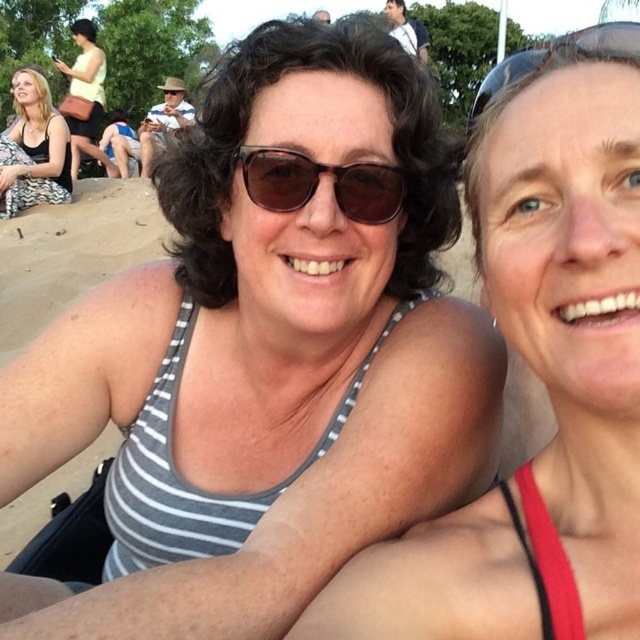
Question: Is gray striped tank top at center above transparent plastic goggles at upper right?

Choices:
 (A) yes
 (B) no

Answer: (B)

Question: Which of the following is the farthest from the observer?

Choices:
 (A) beige sand at lower left
 (B) gray striped tank top at center
 (C) matte black tank top at lower left

Answer: (C)

Question: In this image, where is brown matte sunglasses at center located relative to transparent plastic goggles at upper right?

Choices:
 (A) above
 (B) below

Answer: (B)

Question: Which of the following is the farthest from the observer?

Choices:
 (A) gray striped tank top at center
 (B) brown matte sunglasses at center
 (C) matte black tank top at lower left
 (D) beige sand at lower left

Answer: (C)

Question: Which point is farther to the camera?

Choices:
 (A) gray striped tank top at center
 (B) matte black tank top at lower left
 (C) transparent plastic goggles at upper right

Answer: (B)

Question: In this image, where is gray striped tank top at center located relative to beige sand at lower left?

Choices:
 (A) below
 (B) above

Answer: (A)